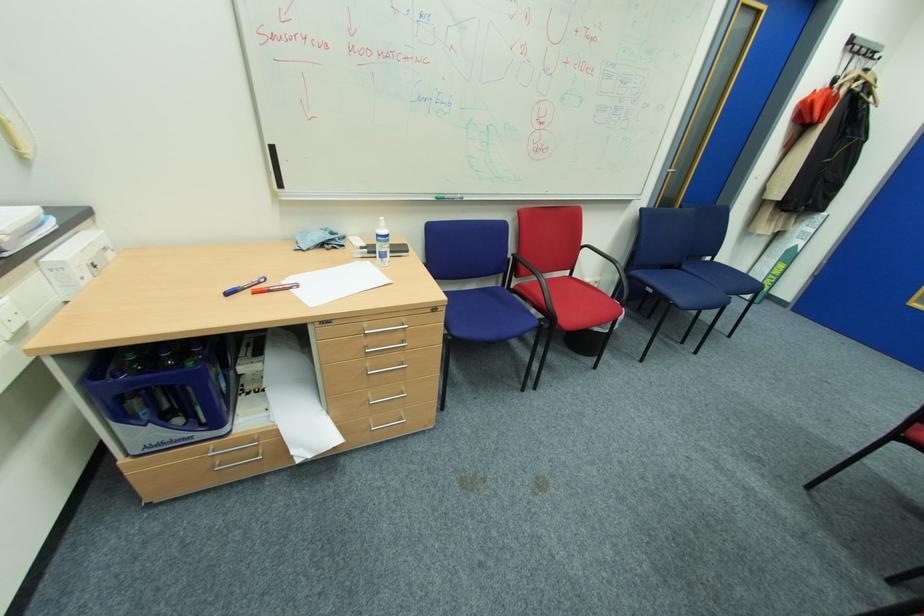
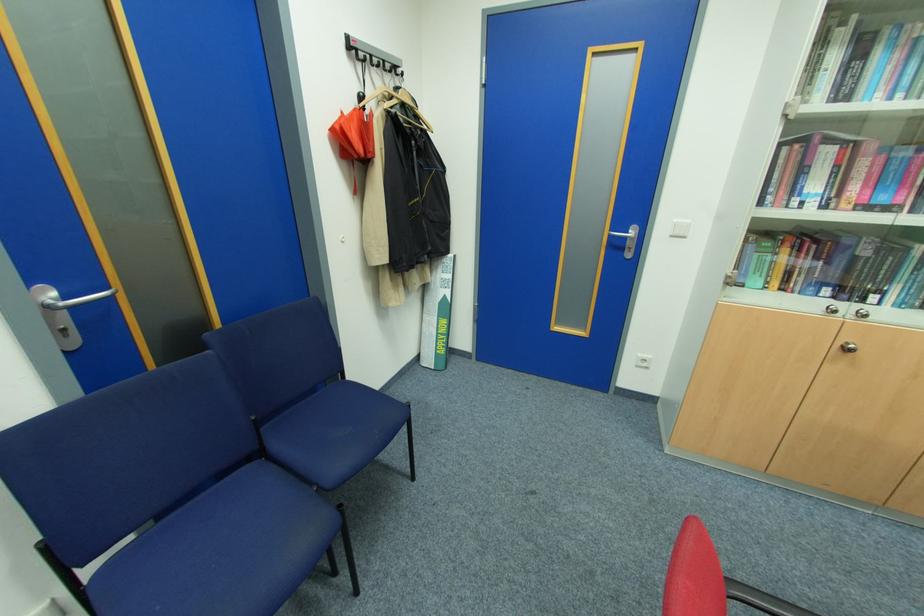
Where in the second image is the point corresponding to (800,246) from the first image?

(448, 296)